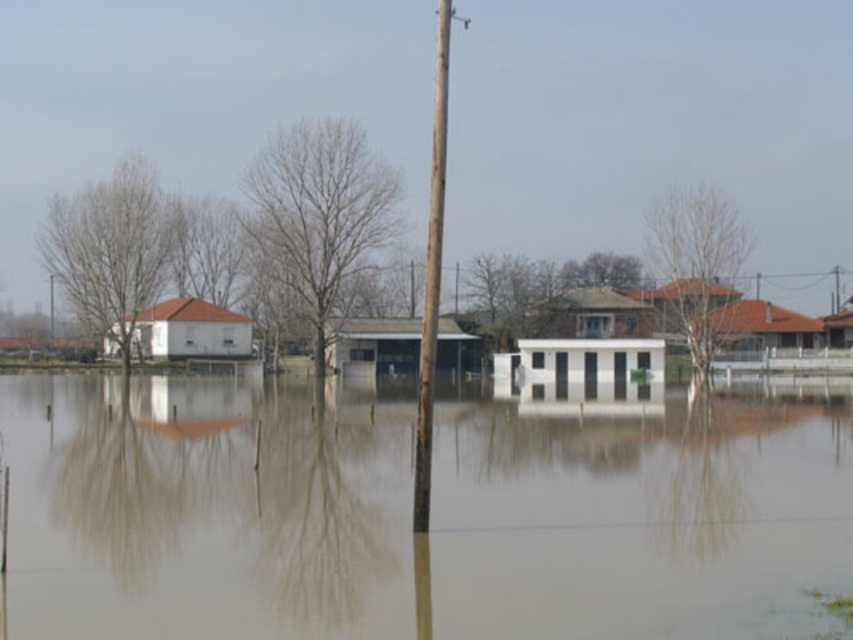
Question: Is brown murky water at center above brown leafless tree at center?

Choices:
 (A) no
 (B) yes

Answer: (A)

Question: Is bare wood tree at center further to camera compared to brown leafless tree at center?

Choices:
 (A) no
 (B) yes

Answer: (A)

Question: Which point is closer to the camera taking this photo?

Choices:
 (A) (415, 518)
 (B) (509, 276)
 (C) (47, 262)

Answer: (A)

Question: Considering the real-world distances, which object is closest to the bare wood tree at left?

Choices:
 (A) brown murky water at center
 (B) brown wooden telegraph pole at center
 (C) brown leafless tree at center
 (D) bare wood tree at center

Answer: (D)

Question: Observing the image, what is the correct spatial positioning of bare wood tree at center in reference to bare wood tree at left?

Choices:
 (A) right
 (B) left

Answer: (A)

Question: Which point appears closest to the camera in this image?

Choices:
 (A) (485, 321)
 (B) (112, 301)
 (C) (416, 520)

Answer: (C)